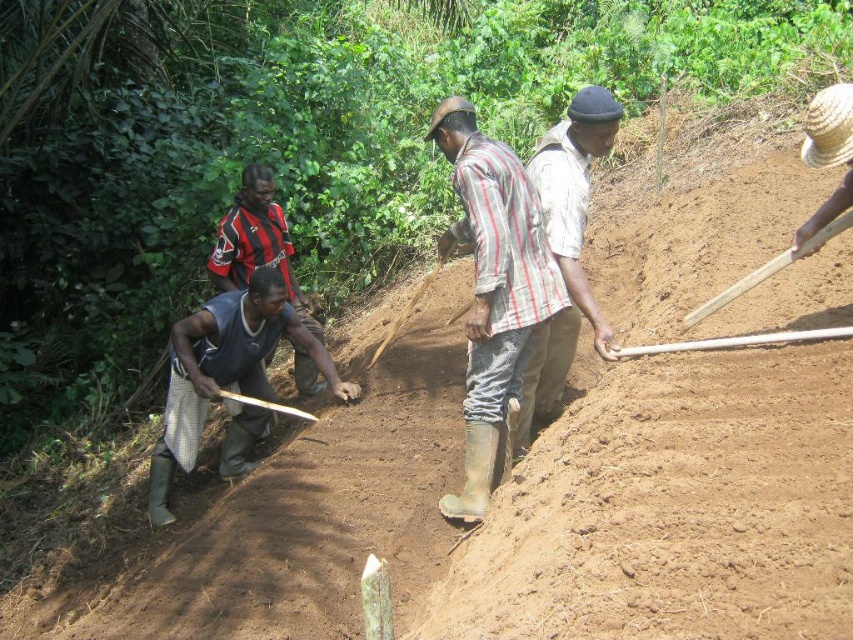
Is gray fabric shirt at center shorter than wooden shovel at right?

Incorrect, gray fabric shirt at center's height does not fall short of wooden shovel at right's.

Is point (244, 380) farther from viewer compared to point (682, 321)?

Yes.

This screenshot has width=853, height=640. Find the location of `gray fabric shirt at center`. gray fabric shirt at center is located at coordinates (225, 369).

Does striped cotton shirt at center appear on the right side of gray fabric shirt at center?

Yes, striped cotton shirt at center is to the right of gray fabric shirt at center.

Does striped cotton shirt at center have a lesser height compared to gray fabric shirt at center?

In fact, striped cotton shirt at center may be taller than gray fabric shirt at center.

Is point (469, 358) positioned before point (175, 371)?

Yes, it is in front of point (175, 371).

Where is `striped cotton shirt at center`? This screenshot has width=853, height=640. striped cotton shirt at center is located at coordinates pos(492,292).

Which of these two, striped cotton shirt at center or light brown fabric shirt at center, stands shorter?

With less height is light brown fabric shirt at center.

Can you confirm if striped cotton shirt at center is wider than light brown fabric shirt at center?

Yes, striped cotton shirt at center is wider than light brown fabric shirt at center.

Identify the location of striped cotton shirt at center. The height and width of the screenshot is (640, 853). (492, 292).

What are the coordinates of `striped cotton shirt at center` in the screenshot? It's located at (492, 292).